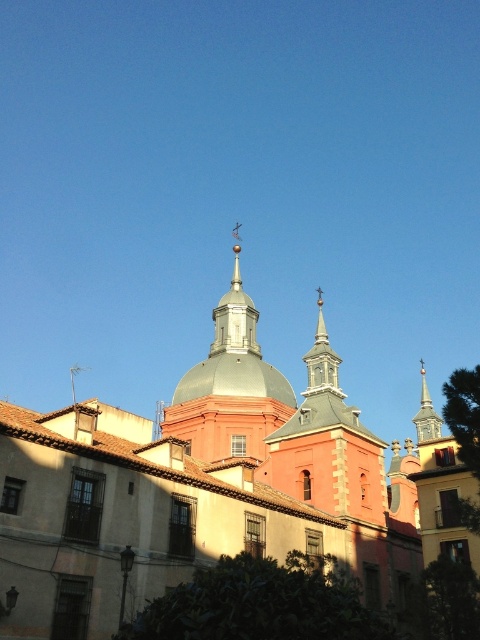
You are standing in front of the historic building and want to locate the smooth gray dome at center. According to the coordinates provided, where would you look relative to the image center?

The smooth gray dome at center is located at coordinates point (x=196, y=486), which is to the right and slightly below the image center.

Based on the scene described, which dome is located below the other between the smooth gray dome at center and the metallic dome at center?

The smooth gray dome at center is positioned under the metallic dome at center.

Looking at the historic buildings, where is the metallic dome at center in relation to the smooth gray spire at upper right?

The metallic dome at center is to the left of the smooth gray spire at upper right.